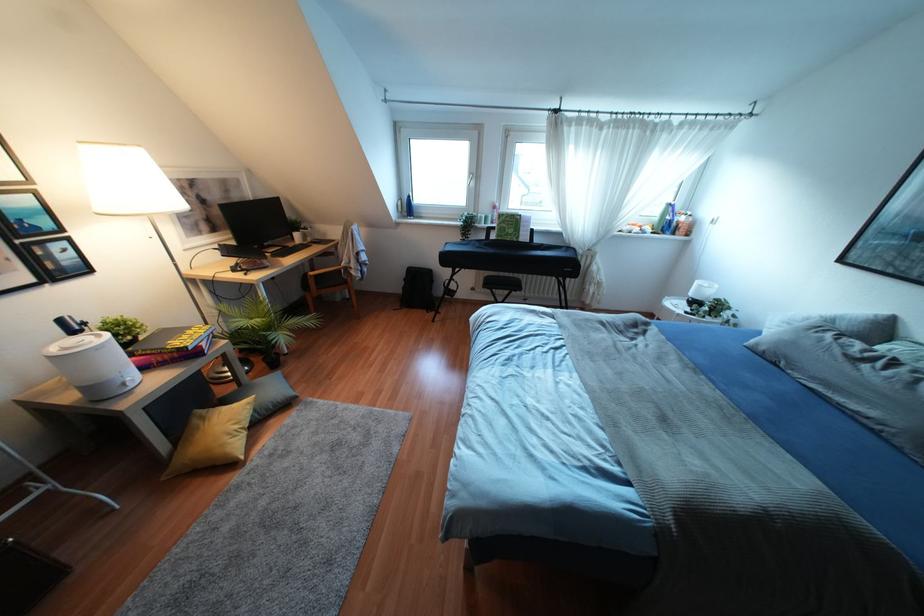
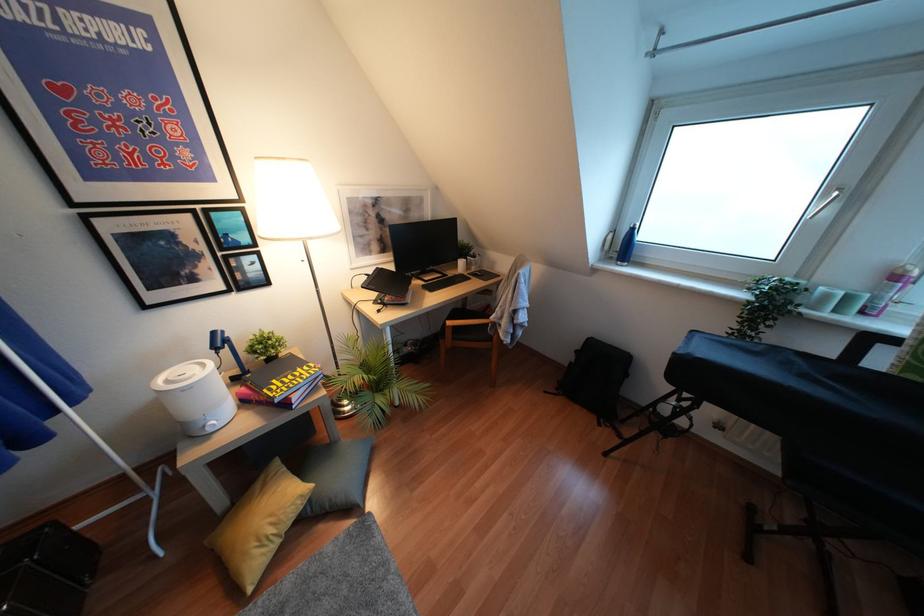
Locate, in the second image, the point that corresponds to (253,410) in the first image.

(310, 500)